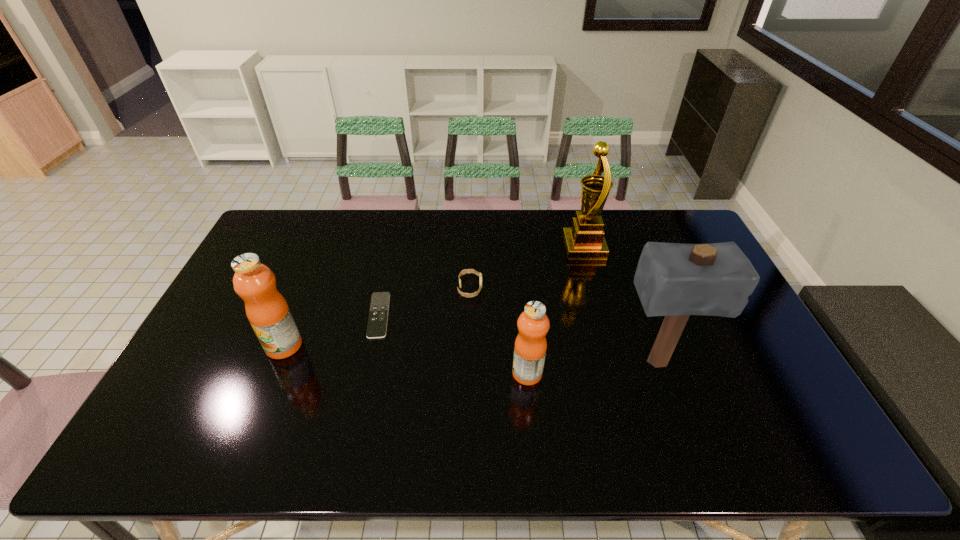
Identify the location of vacant region located on the right of the farther fruit juice. (348, 346).

At what (x,y) coordinates should I click in order to perform the action: click on blank space located 0.340m on the back of the fourth tallest object. Please return your answer as a coordinate pair (x, y). Image resolution: width=960 pixels, height=540 pixels. Looking at the image, I should click on (518, 276).

Identify the location of free location located on the front-facing side of the award. (463, 246).

This screenshot has width=960, height=540. What are the coordinates of `vacant space positioned on the front-facing side of the award` in the screenshot? It's located at (519, 246).

Find the location of a particular element. Image resolution: width=960 pixels, height=540 pixels. free space located on the front-facing side of the award is located at coordinates (525, 246).

Identify the location of vacant space located on the back of the remote control. (396, 239).

Where is `vacant region located on the back of the mallet`? This screenshot has height=540, width=960. vacant region located on the back of the mallet is located at coordinates (633, 298).

The width and height of the screenshot is (960, 540). What are the coordinates of `vacant space positioned on the face of the watch` in the screenshot? It's located at (536, 288).

The image size is (960, 540). I want to click on object at the far edge, so click(585, 239).

Find the location of `object that is positioned at the near edge`. object that is positioned at the near edge is located at coordinates (533, 324).